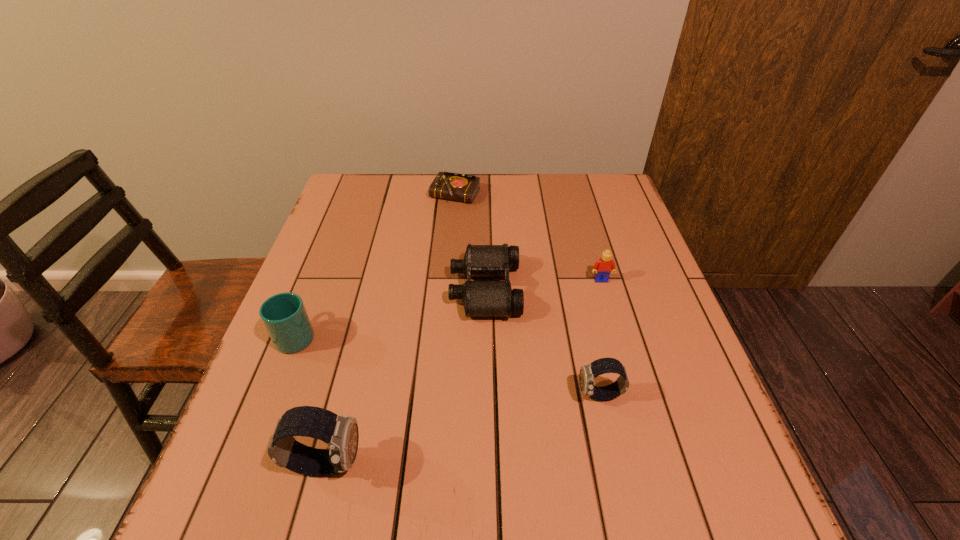
I want to click on vacant space that satisfies the following two spatial constraints: 1. on the front-facing side of the Lego; 2. on the face of the right watch, so click(x=635, y=396).

Identify the location of vacant space that satisfies the following two spatial constraints: 1. on the front-facing side of the Lego; 2. through the eyepieces of the fifth tallest object. The image size is (960, 540). pos(604,289).